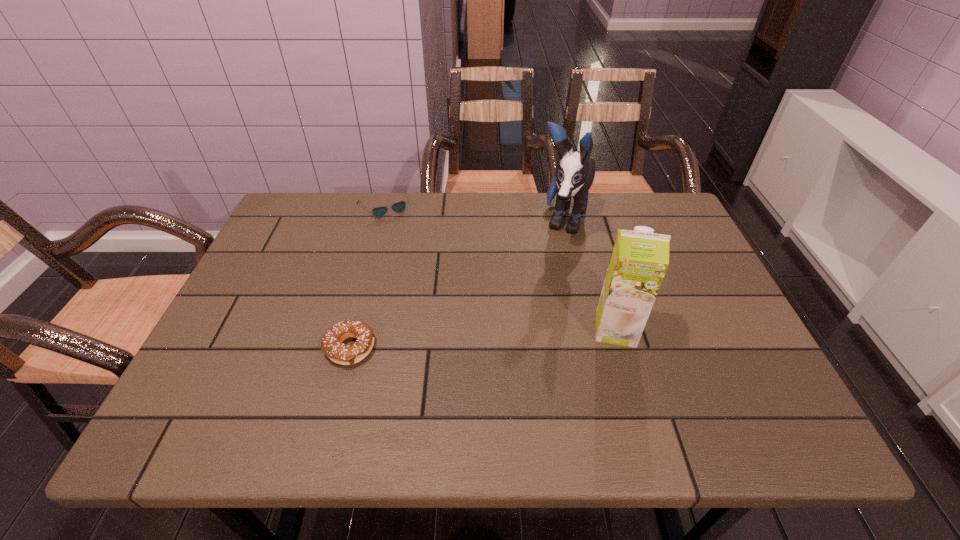
Where is `free location located 0.260m on the lenses of the shortest object`? The height and width of the screenshot is (540, 960). free location located 0.260m on the lenses of the shortest object is located at coordinates (420, 273).

This screenshot has height=540, width=960. Find the location of `free space located 0.090m on the lenses of the shortest object`. free space located 0.090m on the lenses of the shortest object is located at coordinates (401, 236).

At what (x,y) coordinates should I click in order to perform the action: click on puppy located in the far edge section of the desktop. Please return your answer as a coordinate pair (x, y). This screenshot has height=540, width=960. Looking at the image, I should click on (575, 172).

Locate an element on the screen. The height and width of the screenshot is (540, 960). sunglasses at the far edge is located at coordinates (399, 207).

This screenshot has width=960, height=540. What are the coordinates of `object that is at the near edge` in the screenshot? It's located at (331, 344).

Locate an element on the screen. blank area at the far edge is located at coordinates (498, 232).

The width and height of the screenshot is (960, 540). I want to click on free space at the near edge of the desktop, so 665,374.

This screenshot has height=540, width=960. I want to click on vacant area at the left edge, so click(247, 293).

Where is `vacant region at the right edge`? The image size is (960, 540). vacant region at the right edge is located at coordinates (660, 288).

Locate an element on the screen. This screenshot has width=960, height=540. free space at the far left corner of the desktop is located at coordinates (290, 202).